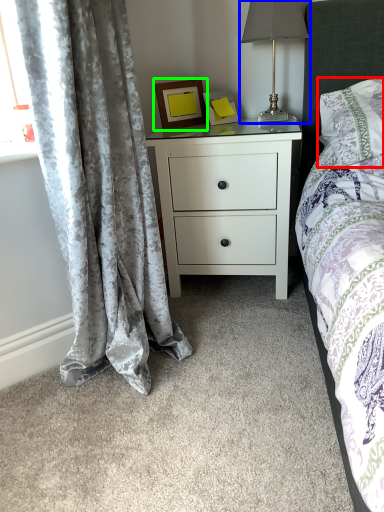
Question: Estimate the real-world distances between objects in this image. Which object is farther from pillow (highlighted by a red box), table lamp (highlighted by a blue box) or picture frame (highlighted by a green box)?

Choices:
 (A) table lamp
 (B) picture frame

Answer: (B)